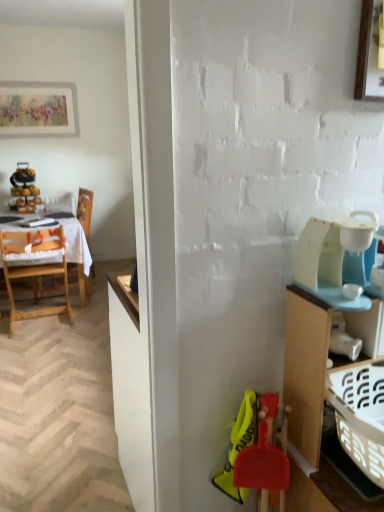
Locate an element on the screen. The width and height of the screenshot is (384, 512). wooden cabinet at right is located at coordinates (334, 381).

Where is `wooden picture frame at upper right, acting as the second picture frame starting from the left`? wooden picture frame at upper right, acting as the second picture frame starting from the left is located at coordinates (370, 52).

This screenshot has width=384, height=512. Describe the element at coordinates (36, 109) in the screenshot. I see `matte white picture frame at upper left, the 2th picture frame positioned from the bottom` at that location.

The height and width of the screenshot is (512, 384). I want to click on wooden chair at left, the first chair positioned from the front, so click(x=34, y=268).

What is the approximate width of wooden chair at left, arranged as the second chair when viewed from the back?

wooden chair at left, arranged as the second chair when viewed from the back, is 21.32 inches wide.

Find the location of a particular element. The width and height of the screenshot is (384, 512). wooden cabinet at right is located at coordinates (334, 381).

Consider the image. Considering the relative sizes of white cloth at left and matte white picture frame at upper left, marked as the 1th picture frame in a back-to-front arrangement, in the image provided, is white cloth at left bigger than matte white picture frame at upper left, marked as the 1th picture frame in a back-to-front arrangement,?

Yes.

Which is behind, point (1, 225) or point (61, 88)?

The point (61, 88) is more distant.

From a real-world perspective, is white cloth at left positioned above or below matte white picture frame at upper left, the 2th picture frame from the right?

From a real-world perspective, white cloth at left is physically below matte white picture frame at upper left, the 2th picture frame from the right.

In terms of height, does white cloth at left look taller or shorter compared to matte white picture frame at upper left, arranged as the second picture frame when viewed from the front?

Clearly, white cloth at left is taller compared to matte white picture frame at upper left, arranged as the second picture frame when viewed from the front.

Who is bigger, white cloth at left or wooden chair at left, the first chair positioned from the front?

With larger size is white cloth at left.

Which is more distant, (77, 241) or (69, 320)?

Positioned behind is point (77, 241).

Who is taller, white cloth at left or wooden chair at left, the first chair positioned from the front?

With more height is wooden chair at left, the first chair positioned from the front.

Can wooden chair at left, the first chair positioned from the front, be found inside white cloth at left?

Yes, white cloth at left is surrounding wooden chair at left, the first chair positioned from the front.

Is wooden chair at left, positioned as the first chair in back-to-front order, surrounded by matte white picture frame at upper left, marked as the 1th picture frame in a back-to-front arrangement?

No.

Considering the relative sizes of matte white picture frame at upper left, marked as the 1th picture frame in a back-to-front arrangement, and wooden chair at left, positioned as the first chair in back-to-front order, in the image provided, is matte white picture frame at upper left, marked as the 1th picture frame in a back-to-front arrangement, wider than wooden chair at left, positioned as the first chair in back-to-front order,?

In fact, matte white picture frame at upper left, marked as the 1th picture frame in a back-to-front arrangement, might be narrower than wooden chair at left, positioned as the first chair in back-to-front order.

Is point (19, 96) closer to viewer compared to point (86, 195)?

Yes, it is in front of point (86, 195).

From a real-world perspective, is matte white picture frame at upper left, the 2th picture frame from the right, located higher than wooden chair at left, which is the second chair in front-to-back order?

Yes, from a real-world perspective, matte white picture frame at upper left, the 2th picture frame from the right, is above wooden chair at left, which is the second chair in front-to-back order.

You are a GUI agent. You are given a task and a screenshot of the screen. Output one action in this format:
    pyautogui.click(x=<x>, y=<y>)
    Task: Click on the appliance on the right of wooden chair at left, which is the second chair in front-to-back order
    Image resolution: width=384 pixels, height=512 pixels.
    Given the screenshot: What is the action you would take?
    pyautogui.click(x=331, y=250)

In the scene shown: Does wooden chair at left, which is the second chair in front-to-back order, lie behind white plastic coffee maker at right?

Yes.

From the image's perspective, is wooden chair at left, which is the second chair in front-to-back order, under white plastic coffee maker at right?

Actually, wooden chair at left, which is the second chair in front-to-back order, appears above white plastic coffee maker at right in the image.

From a real-world perspective, is matte white picture frame at upper left, arranged as the second picture frame when viewed from the front, located higher than wooden cabinet at right?

Indeed, from a real-world perspective, matte white picture frame at upper left, arranged as the second picture frame when viewed from the front, stands above wooden cabinet at right.

Is point (42, 132) closer to viewer compared to point (372, 310)?

No, it is behind (372, 310).

From the image's perspective, does matte white picture frame at upper left, the 2th picture frame positioned from the bottom, appear higher than wooden cabinet at right?

Yes.

Which is more to the left, matte white picture frame at upper left, marked as the 1th picture frame in a back-to-front arrangement, or wooden cabinet at right?

matte white picture frame at upper left, marked as the 1th picture frame in a back-to-front arrangement, is more to the left.

Can you confirm if wooden chair at left, which is the second chair in front-to-back order, is smaller than wooden picture frame at upper right, the first picture frame viewed from the front?

Incorrect, wooden chair at left, which is the second chair in front-to-back order, is not smaller in size than wooden picture frame at upper right, the first picture frame viewed from the front.

Is wooden chair at left, positioned as the first chair in back-to-front order, located outside wooden picture frame at upper right, arranged as the 2th picture frame when viewed from the back?

Yes, wooden chair at left, positioned as the first chair in back-to-front order, is not within wooden picture frame at upper right, arranged as the 2th picture frame when viewed from the back.

Is wooden chair at left, which is the second chair in front-to-back order, not near wooden picture frame at upper right, the first picture frame viewed from the front?

Yes, wooden chair at left, which is the second chair in front-to-back order, is far from wooden picture frame at upper right, the first picture frame viewed from the front.

Between wooden chair at left, positioned as the first chair in back-to-front order, and wooden picture frame at upper right, the first picture frame viewed from the front, which one appears on the right side from the viewer's perspective?

Positioned to the right is wooden picture frame at upper right, the first picture frame viewed from the front.

Can you confirm if white plastic coffee maker at right is bigger than wooden cabinet at right?

Actually, white plastic coffee maker at right might be smaller than wooden cabinet at right.

Is white plastic coffee maker at right not inside wooden cabinet at right?

Yes, white plastic coffee maker at right is outside of wooden cabinet at right.

Which of these two, white plastic coffee maker at right or wooden cabinet at right, stands shorter?

white plastic coffee maker at right.

The width and height of the screenshot is (384, 512). Find the location of `tablecloth in front of the matte white picture frame at upper left, marked as the 1th picture frame in a back-to-front arrangement`. tablecloth in front of the matte white picture frame at upper left, marked as the 1th picture frame in a back-to-front arrangement is located at coordinates (76, 244).

Image resolution: width=384 pixels, height=512 pixels. In order to click on chair below the white cloth at left (from the image's perspective) in this screenshot , I will do `click(34, 268)`.

When comparing their distances from wooden cabinet at right, does wooden chair at left, arranged as the second chair when viewed from the back, or matte white picture frame at upper left, the 2th picture frame positioned from the bottom, seem closer?

wooden chair at left, arranged as the second chair when viewed from the back.

Looking at the image, which one is located further to white cloth at left, matte white picture frame at upper left, which ranks as the first picture frame in top-to-bottom order, or wooden chair at left, positioned as the first chair in back-to-front order?

matte white picture frame at upper left, which ranks as the first picture frame in top-to-bottom order, lies further to white cloth at left than the other object.

Consider the image. Estimate the real-world distances between objects in this image. Which object is further from wooden cabinet at right, wooden chair at left, arranged as the second chair when viewed from the back, or wooden chair at left, positioned as the first chair in back-to-front order?

The object further to wooden cabinet at right is wooden chair at left, positioned as the first chair in back-to-front order.

From the image, which object appears to be farther from matte white picture frame at upper left, the 2th picture frame positioned from the bottom, white plastic coffee maker at right or wooden cabinet at right?

Based on the image, wooden cabinet at right appears to be further to matte white picture frame at upper left, the 2th picture frame positioned from the bottom.

Based on their spatial positions, is wooden chair at left, the first chair positioned from the front, or wooden picture frame at upper right, acting as the second picture frame starting from the left, closer to white cloth at left?

wooden chair at left, the first chair positioned from the front.

Which object lies nearer to the anchor point white cloth at left, matte white picture frame at upper left, arranged as the second picture frame when viewed from the front, or wooden chair at left, arranged as the second chair when viewed from the back?

wooden chair at left, arranged as the second chair when viewed from the back, lies closer to white cloth at left than the other object.

From the image, which object appears to be farther from wooden chair at left, which is the second chair in front-to-back order, wooden picture frame at upper right, arranged as the 2th picture frame when viewed from the back, or matte white picture frame at upper left, marked as the 1th picture frame in a back-to-front arrangement?

wooden picture frame at upper right, arranged as the 2th picture frame when viewed from the back, is further to wooden chair at left, which is the second chair in front-to-back order.

When comparing their distances from matte white picture frame at upper left, the 2th picture frame positioned from the bottom, does wooden cabinet at right or white plastic coffee maker at right seem closer?

The object closer to matte white picture frame at upper left, the 2th picture frame positioned from the bottom, is white plastic coffee maker at right.

Locate an element on the screen. This screenshot has width=384, height=512. picture frame between white plastic coffee maker at right and wooden chair at left, positioned as the first chair in back-to-front order, from front to back is located at coordinates (370, 52).

You are a GUI agent. You are given a task and a screenshot of the screen. Output one action in this format:
    pyautogui.click(x=<x>, y=<y>)
    Task: Click on the chair between matte white picture frame at upper left, which ranks as the first picture frame in top-to-bottom order, and white cloth at left from top to bottom
    
    Given the screenshot: What is the action you would take?
    click(85, 212)

I want to click on chair between wooden cabinet at right and wooden chair at left, which is the second chair in front-to-back order, along the z-axis, so [x=34, y=268].

At what (x,y) coordinates should I click in order to perform the action: click on appliance between wooden cabinet at right and matte white picture frame at upper left, the 2th picture frame from the right, along the z-axis. Please return your answer as a coordinate pair (x, y). Looking at the image, I should click on (331, 250).